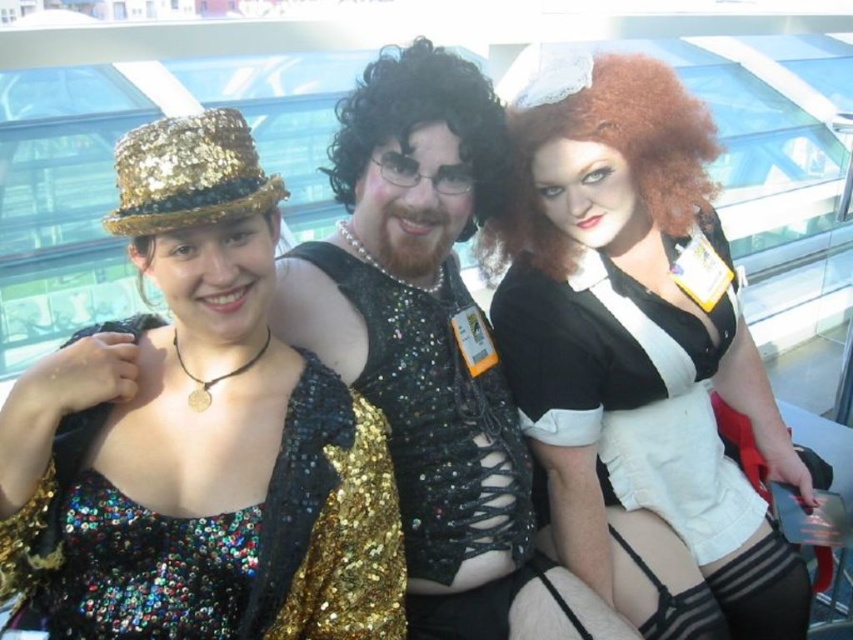
Is point (573, 237) positioned behind point (537, 76)?

Yes, point (573, 237) is behind point (537, 76).

At what (x,y) coordinates should I click in order to perform the action: click on white matte dress at center. Please return your answer as a coordinate pair (x, y). The width and height of the screenshot is (853, 640). Looking at the image, I should click on (639, 362).

Which is in front, point (544, 273) or point (515, 134)?

Point (515, 134) is in front.

Locate an element on the screen. The image size is (853, 640). white matte dress at center is located at coordinates (639, 362).

Who is more forward, (355, 364) or (550, 268)?

Point (355, 364)

Does sequined fabric vest at center have a smaller size compared to curly brown wig at center?

No, sequined fabric vest at center is not smaller than curly brown wig at center.

Which is behind, point (376, 204) or point (593, 81)?

Positioned behind is point (593, 81).

Identify the location of sequined fabric vest at center. The width and height of the screenshot is (853, 640). (433, 348).

Does white matte dress at center have a lesser width compared to sequined fabric vest at center?

Incorrect, white matte dress at center's width is not less than sequined fabric vest at center's.

Who is taller, white matte dress at center or sequined fabric vest at center?

Standing taller between the two is white matte dress at center.

Which is in front, point (619, 349) or point (292, 339)?

Positioned in front is point (292, 339).

The image size is (853, 640). Identify the location of white matte dress at center. (639, 362).